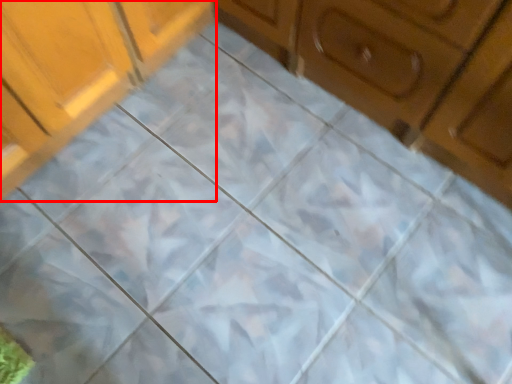
Question: From the image's perspective, where is cabinetry (annotated by the red box) located in relation to cabinetry in the image?

Choices:
 (A) below
 (B) above

Answer: (B)